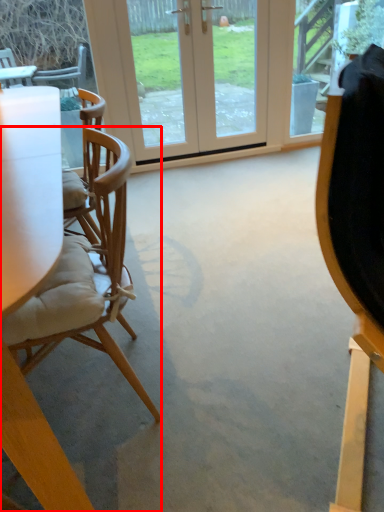
Question: From the image's perspective, where is chair (annotated by the red box) located relative to door?

Choices:
 (A) below
 (B) above

Answer: (A)